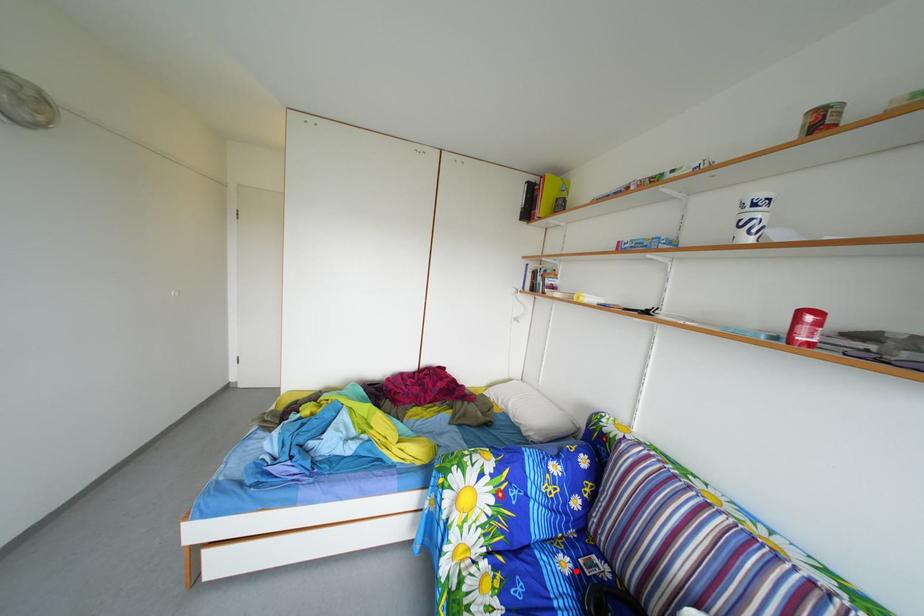
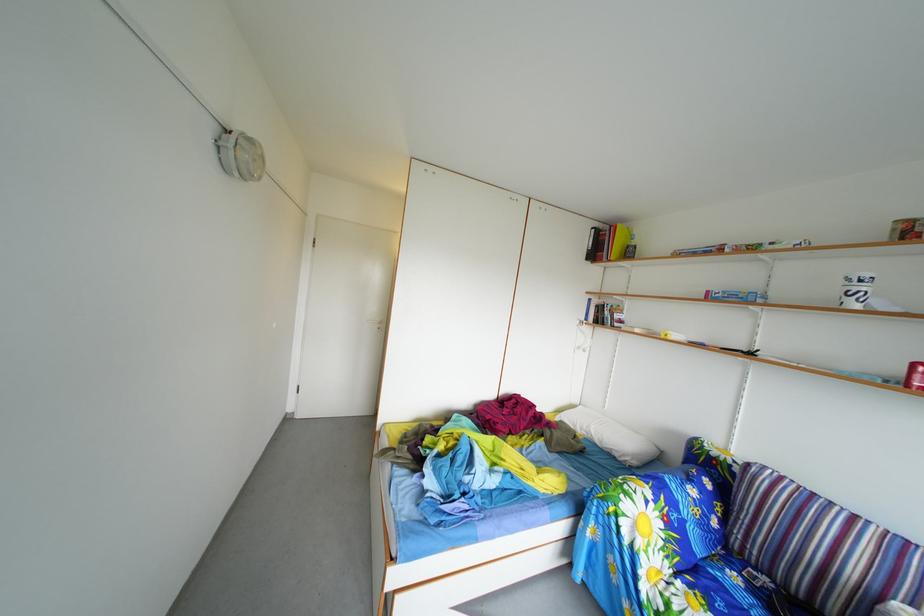
In the second image, find the point that corresponds to the highlighted location in the first image.

(746, 585)